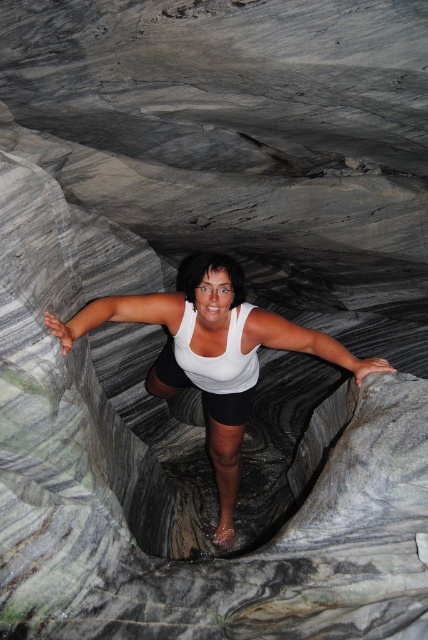
At what (x,y) coordinates should I click in order to perform the action: click on white matte tank top at center. Please return your answer as a coordinate pair (x, y). The image size is (428, 640). Looking at the image, I should click on (213, 353).

Who is positioned more to the left, white matte tank top at center or white smooth arm at center?

From the viewer's perspective, white smooth arm at center appears more on the left side.

Locate an element on the screen. The width and height of the screenshot is (428, 640). white matte tank top at center is located at coordinates (213, 353).

What do you see at coordinates (213, 353) in the screenshot?
I see `white matte tank top at center` at bounding box center [213, 353].

What do you see at coordinates (213, 353) in the screenshot?
I see `white matte tank top at center` at bounding box center [213, 353].

This screenshot has width=428, height=640. Identify the location of white matte tank top at center. (213, 353).

Does white smooth arm at center have a smaller size compared to white matte arm at center?

No.

Consider the image. Who is more forward, (x=168, y=310) or (x=366, y=358)?

Point (x=366, y=358) is in front.

Is point (67, 321) in front of point (243, 332)?

That is True.

In order to click on white smooth arm at center in this screenshot , I will do `click(118, 314)`.